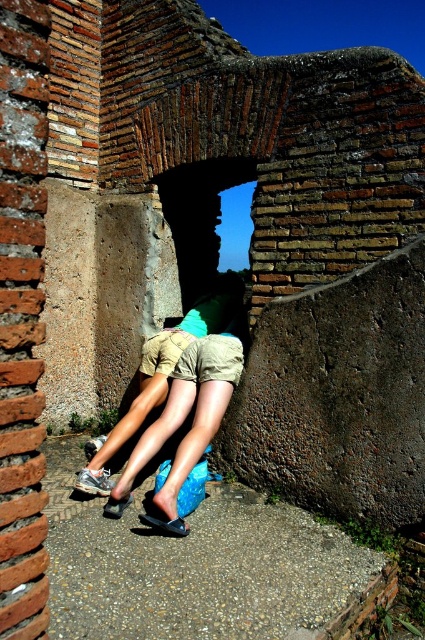
In the scene shown: You are standing on the ancient brick pathway and see the khaki shorts at center and the black matte sandal at lower center. Which object is positioned closer to your left side?

The khaki shorts at center is to the left of black matte sandal at lower center, so the khaki shorts at center is closer to your left side.

You are a photographer trying to capture the khaki shorts at center and the black leather sandal at lower center in the same frame. Which object should you focus on first if you want to ensure both are in focus without adjusting your camera settings?

You should focus on the khaki shorts at center first because it is larger in size compared to the black leather sandal at lower center, making it easier to achieve focus on the larger object before adjusting for the smaller one.

You are standing at the point closer to the camera in this ancient brick structure. There are two points marked in the scene, point A at coordinates point A is point (204, 307) and point B at coordinates point B is point (163, 524). Which point is closer to your current position?

Point A at coordinates point A is point (204, 307) is further to the camera than point B at coordinates point B is point (163, 524). Since you are standing at the point closer to the camera, which is point B, your current position is closer to point B.